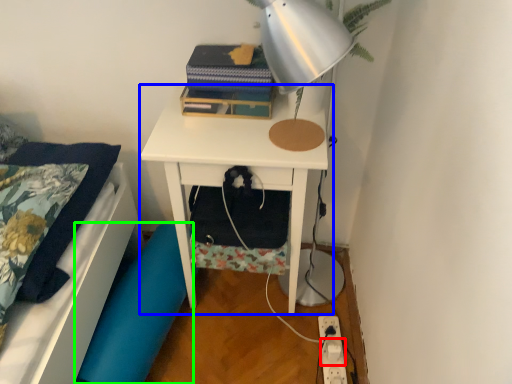
Question: Estimate the real-world distances between objects in this image. Which object is farther from electric outlet (highlighted by a red box), nightstand (highlighted by a blue box) or swivel chair (highlighted by a green box)?

Choices:
 (A) nightstand
 (B) swivel chair

Answer: (A)